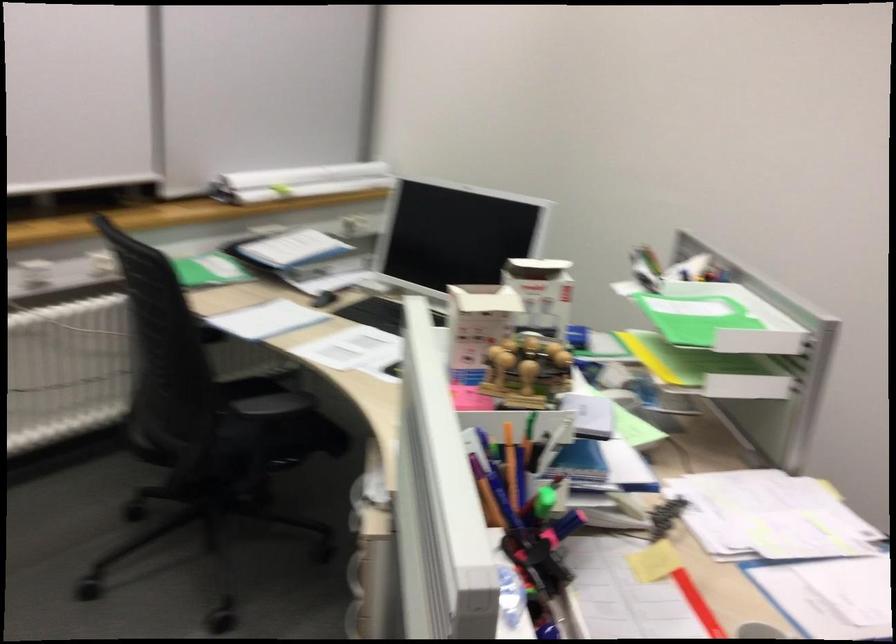
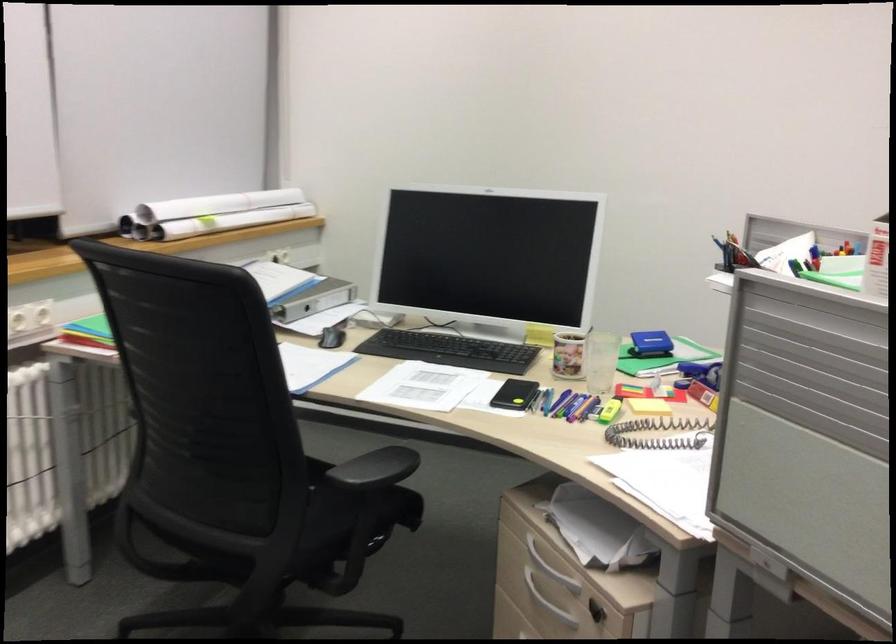
Find the pixel in the second image that matches pixel 357 506 in the first image.

(550, 567)